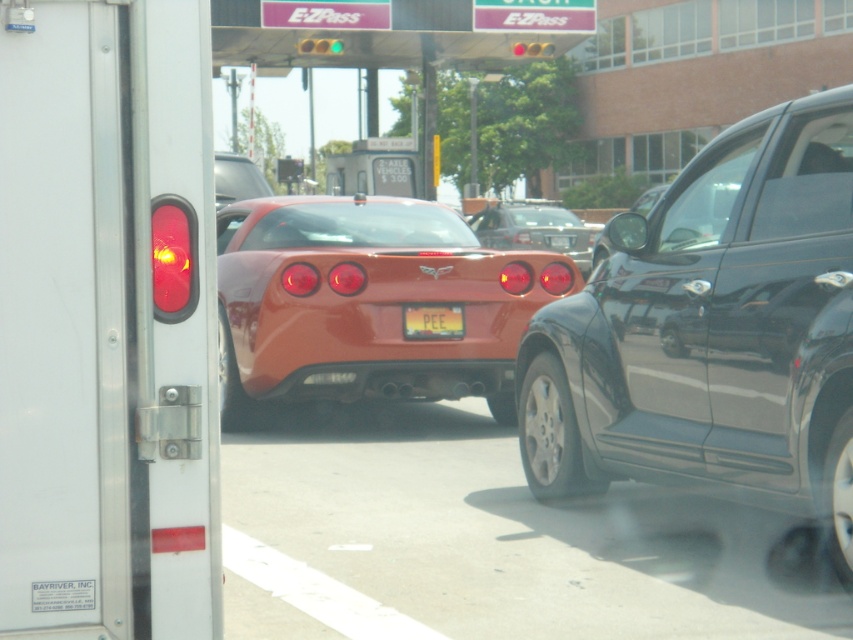
What object is located at the coordinate point (173, 259) in the scene?

The point (173, 259) corresponds to the matte red taillight at left.

You are a driver approaching the toll booth in the image. You notice two points marked on the road ahead. The first point is at coordinates point [158,260], and the second point is at point [416,324]. Which point is closer to your current position as you approach the toll booth?

The point at coordinates point [158,260] is closer to the camera, so it is closer to your current position as you approach the toll booth.

You are a driver in the glossy black car at center. You want to exit the toll booth area as quickly as possible. Is there a way to pass the glossy orange car at center in this lane?

The glossy black car at center is behind the glossy orange car at center, so it cannot pass it in this lane since there is no mention of another lane or space available for overtaking.